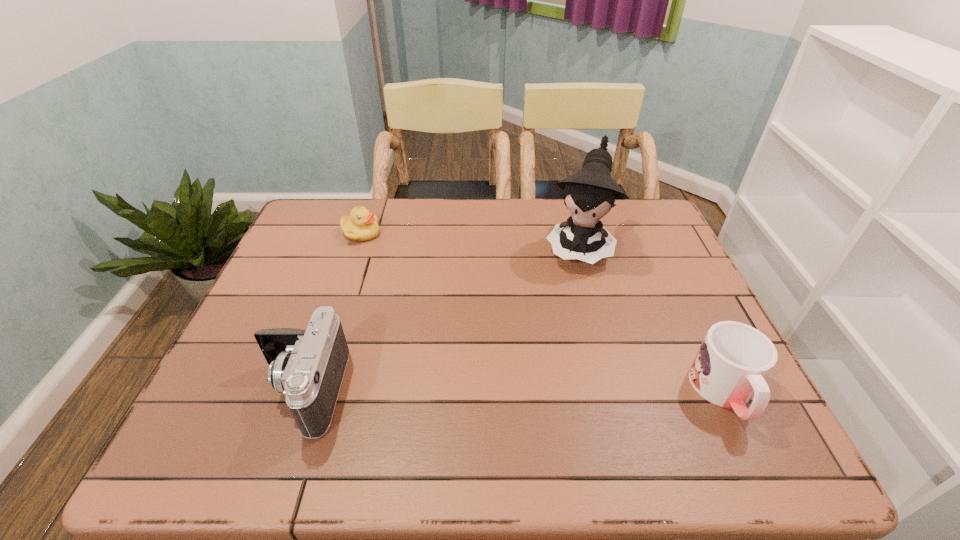
What are the coordinates of `free spot located at the face of the tallest object` in the screenshot? It's located at (555, 332).

Where is `free location located at the face of the tallest object`? The width and height of the screenshot is (960, 540). free location located at the face of the tallest object is located at coordinates (541, 374).

In order to click on vacant space located at the face of the tallest object in this screenshot , I will do `click(540, 381)`.

Locate an element on the screen. The width and height of the screenshot is (960, 540). duckling that is at the far edge is located at coordinates (361, 225).

Locate an element on the screen. doll positioned at the far edge is located at coordinates (590, 194).

At what (x,y) coordinates should I click in order to perform the action: click on camera present at the near edge. Please return your answer as a coordinate pair (x, y). Looking at the image, I should click on (307, 366).

You are a GUI agent. You are given a task and a screenshot of the screen. Output one action in this format:
    pyautogui.click(x=<x>, y=<y>)
    Task: Click on the mug present at the near edge
    This screenshot has width=960, height=540.
    Given the screenshot: What is the action you would take?
    pyautogui.click(x=733, y=360)

Where is `camera situated at the left edge`? camera situated at the left edge is located at coordinates click(x=307, y=366).

The height and width of the screenshot is (540, 960). I want to click on duckling located at the left edge, so click(361, 225).

At what (x,y) coordinates should I click in order to perform the action: click on object that is at the right edge. Please return your answer as a coordinate pair (x, y). The width and height of the screenshot is (960, 540). Looking at the image, I should click on (733, 360).